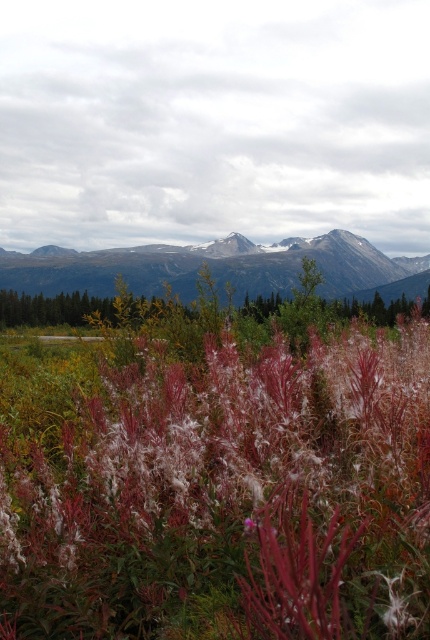
Between fuzzy pink plant at center and rocky gray mountains at center, which one appears on the left side from the viewer's perspective?

fuzzy pink plant at center

Based on the photo, between fuzzy pink plant at center and rocky gray mountains at center, which one is positioned lower?

Positioned lower is fuzzy pink plant at center.

What do you see at coordinates (227, 497) in the screenshot?
I see `fuzzy pink plant at center` at bounding box center [227, 497].

What are the coordinates of `fuzzy pink plant at center` in the screenshot? It's located at (227, 497).